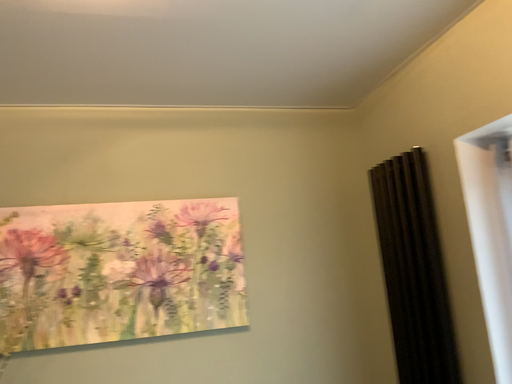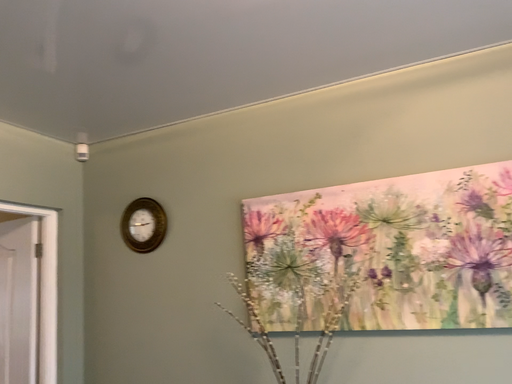
Question: How did the camera likely rotate when shooting the video?

Choices:
 (A) rotated right
 (B) rotated left

Answer: (B)